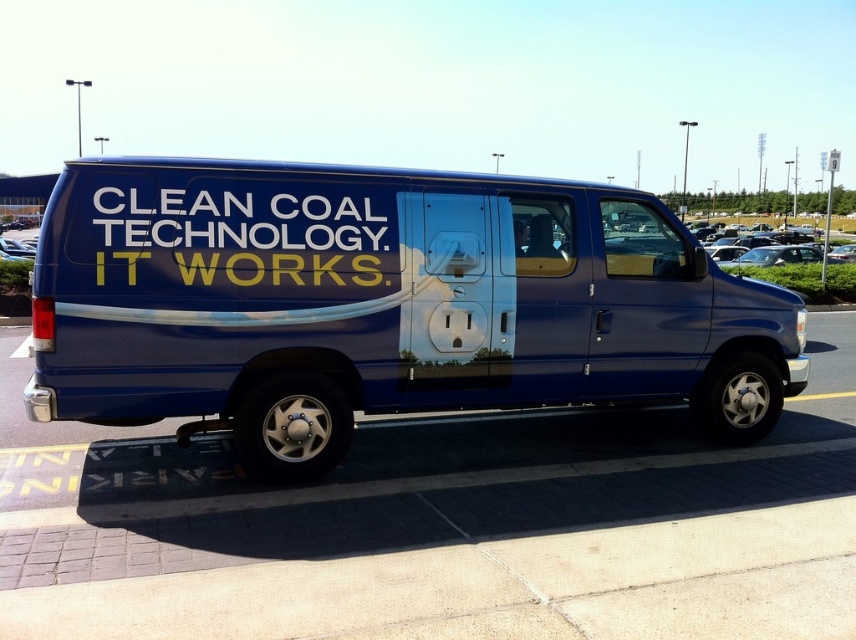
This screenshot has width=856, height=640. What are the coordinates of `blue metallic van at center` in the screenshot? It's located at (383, 304).

Is blue metallic van at center taller than whitematerial/texturetext at side?

Correct, blue metallic van at center is much taller as whitematerial/texturetext at side.

You are a GUI agent. You are given a task and a screenshot of the screen. Output one action in this format:
    pyautogui.click(x=<x>, y=<y>)
    Task: Click on the blue metallic van at center
    This screenshot has height=640, width=856.
    Given the screenshot: What is the action you would take?
    pyautogui.click(x=383, y=304)